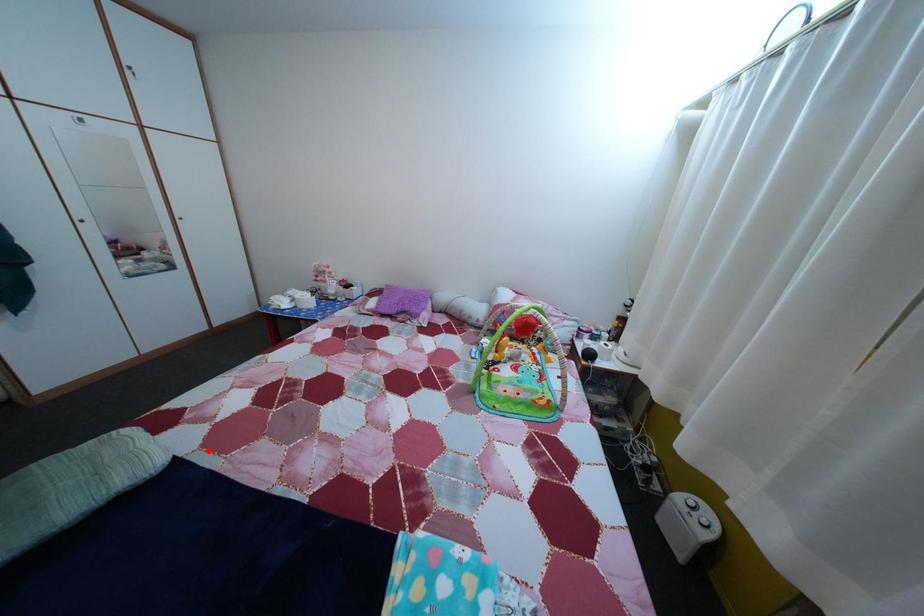
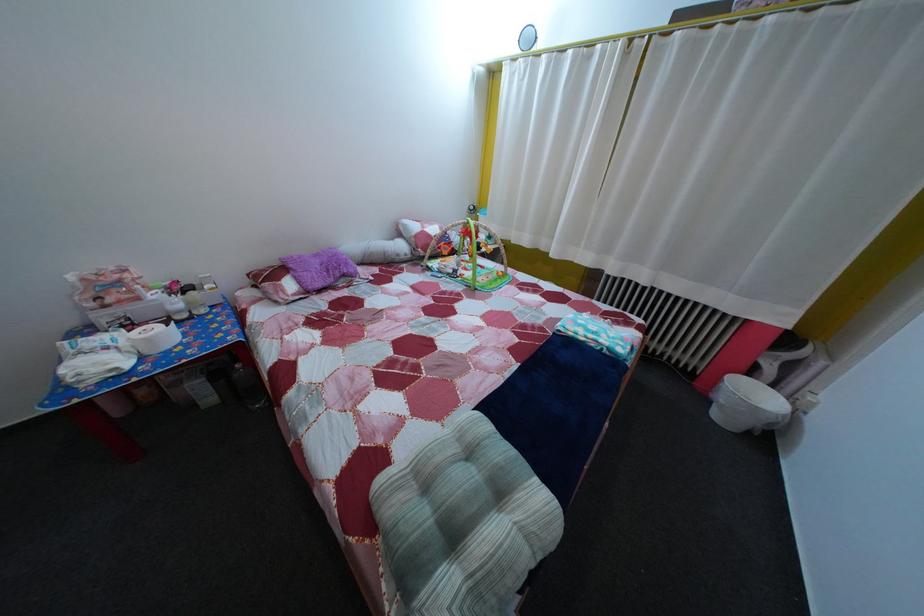
Question: I am providing you with two images of the same scene from different viewpoints. A red point is marked on the first image. At the location where the point appears in image 1, is it still visible in image 2?

Choices:
 (A) Yes
 (B) No

Answer: (A)